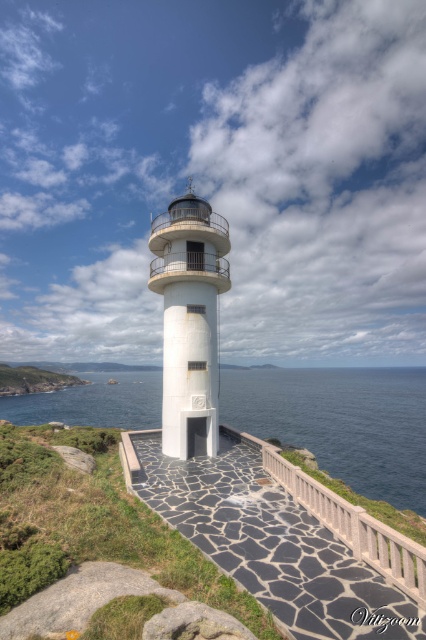
Question: Is black stone path at center positioned behind white smooth lighthouse at center?

Choices:
 (A) yes
 (B) no

Answer: (B)

Question: Can you confirm if black stone path at center is positioned to the left of white smooth lighthouse at center?

Choices:
 (A) yes
 (B) no

Answer: (B)

Question: Among these objects, which one is nearest to the camera?

Choices:
 (A) white smooth lighthouse at center
 (B) blue water at center
 (C) black stone path at center

Answer: (C)

Question: Which of the following is the farthest from the observer?

Choices:
 (A) (155, 397)
 (B) (333, 540)

Answer: (A)

Question: Is blue water at center positioned in front of white smooth lighthouse at center?

Choices:
 (A) no
 (B) yes

Answer: (A)

Question: Which is nearer to the blue water at center?

Choices:
 (A) black stone path at center
 (B) white smooth lighthouse at center

Answer: (A)